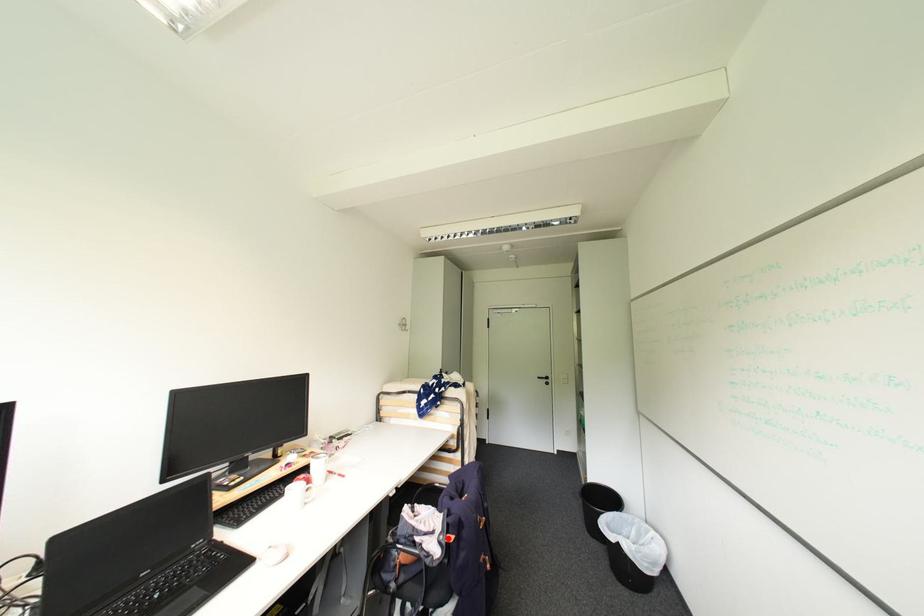
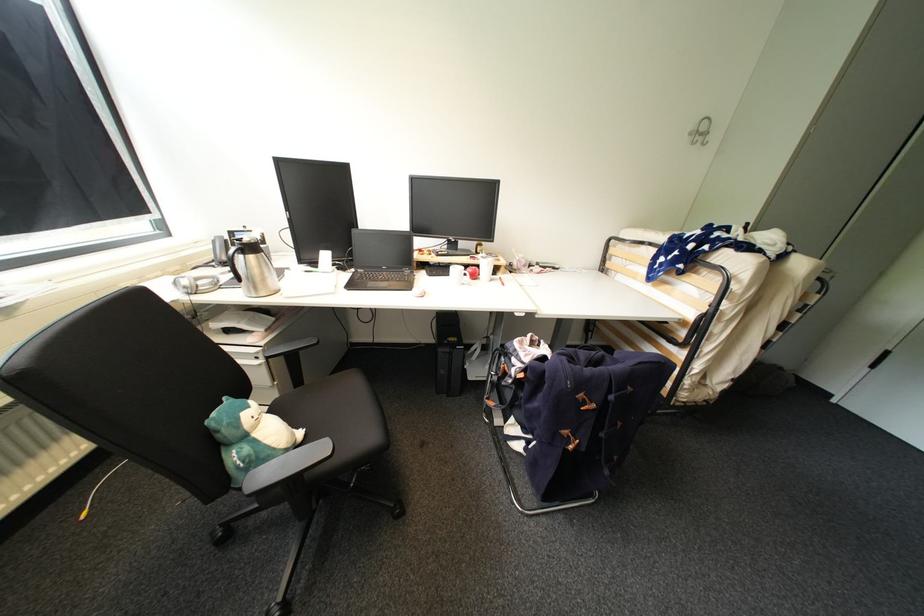
Question: I am providing you with two images of the same scene from different viewpoints. A red point is marked on the first image. At the location where the point appears in image 1, is it still visible in image 2?

Choices:
 (A) Yes
 (B) No

Answer: (B)